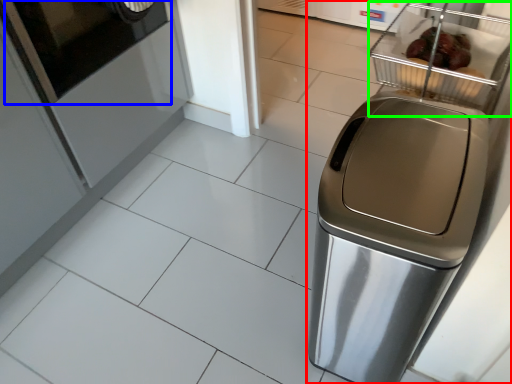
Question: Which is nearer to the home appliance (highlighted by a red box)? screen door (highlighted by a blue box) or basket (highlighted by a green box).

Choices:
 (A) screen door
 (B) basket

Answer: (B)